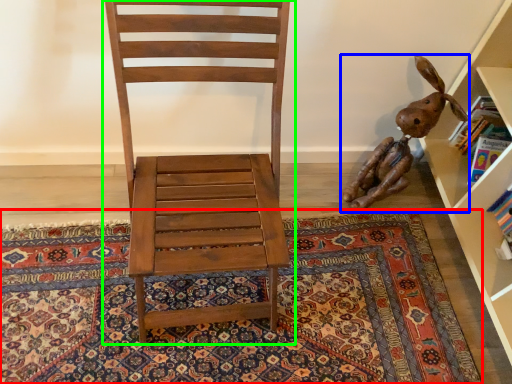
Question: Which is farther away from mat (highlighted by a red box)? toy (highlighted by a blue box) or chair (highlighted by a green box)?

Choices:
 (A) toy
 (B) chair

Answer: (B)